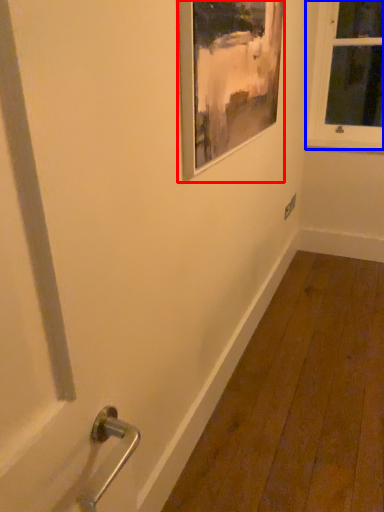
Question: Which of the following is the closest to the observer, picture frame (highlighted by a red box) or window (highlighted by a blue box)?

Choices:
 (A) picture frame
 (B) window

Answer: (A)